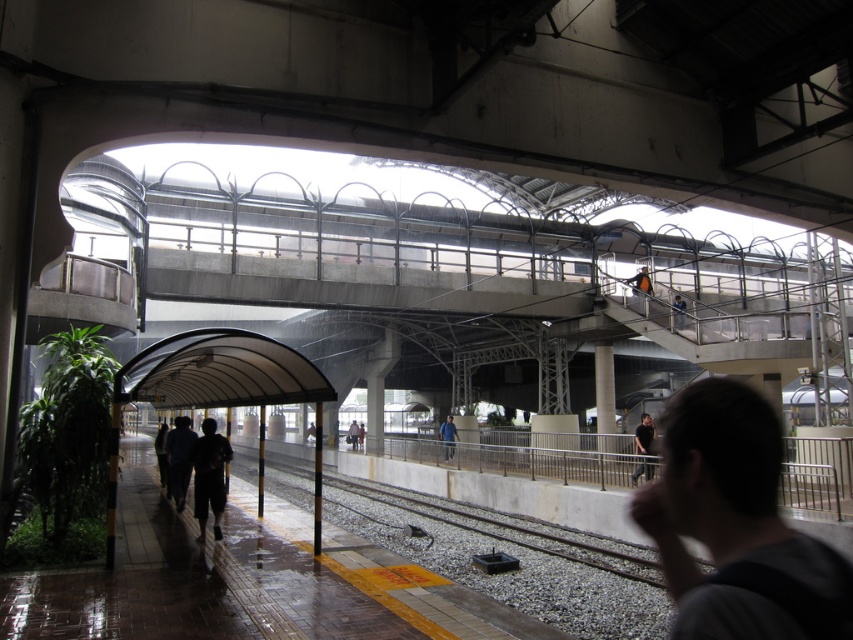
You are a traveler at the train station and you see two jackets hanging on a bench. The dark gray fabric jacket at center and the blue denim jacket at upper center. Which jacket is bigger?

The dark gray fabric jacket at center is larger in size compared to the blue denim jacket at upper center.

You are standing on the train station platform during a rainy day. There is a point at coordinates point (x=845, y=636) that you need to reach. Considering the platform layout described, can you safely walk to this point without stepping onto the railway tracks?

The distance between you and point (x=845, y=636) is 6.12 feet. Since the platform has a safety feature like the yellow tactile paving strip and a concrete wall separating the tracks, you can safely walk to the point without stepping onto the railway tracks.